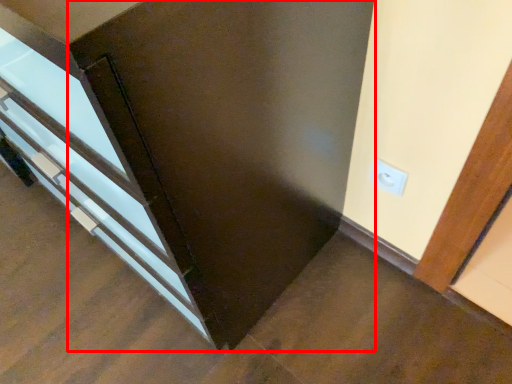
Question: Considering the relative positions of door (annotated by the red box) and electric outlet in the image provided, where is door (annotated by the red box) located with respect to the staircase?

Choices:
 (A) left
 (B) right

Answer: (A)